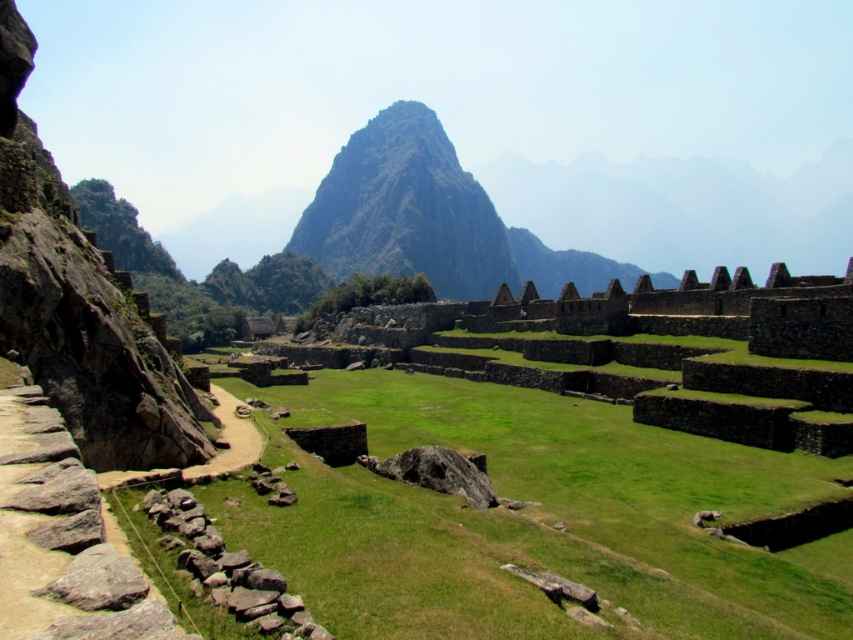
You are standing at the entrance of Machu Picchu and want to reach the green rocky mountain at center. If your walking speed is 3 feet per second, how long will it take you to reach the mountain?

The distance between you and the green rocky mountain at center is 1304.61 feet. At a walking speed of 3 feet per second, it will take approximately 434.87 seconds, which is about 7 minutes and 15 seconds, to reach the mountain.

You are standing at point (x=244, y=611) and want to walk to point (x=393, y=556). Is the destination point behind you or in front of you?

The destination point (x=393, y=556) is behind point (x=244, y=611), so it is behind you.